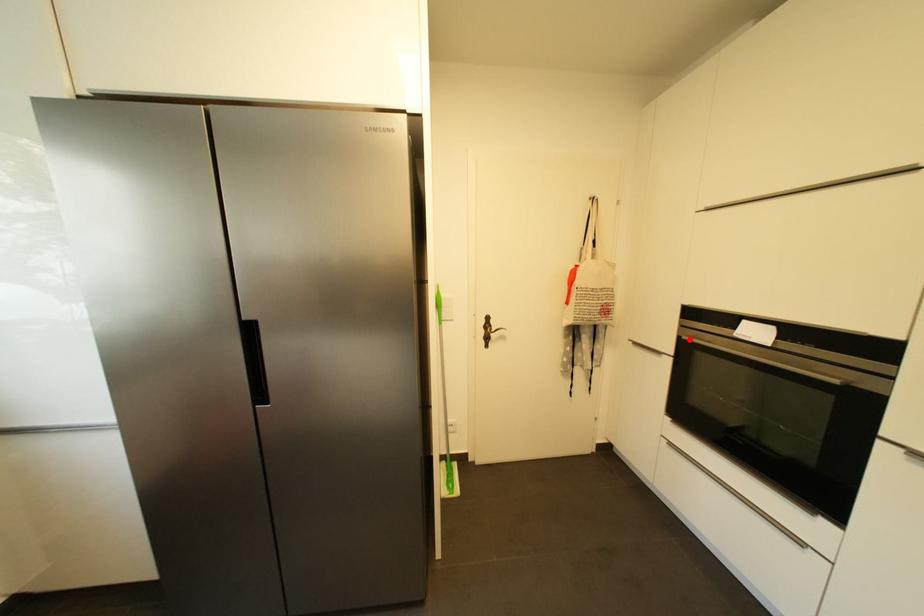
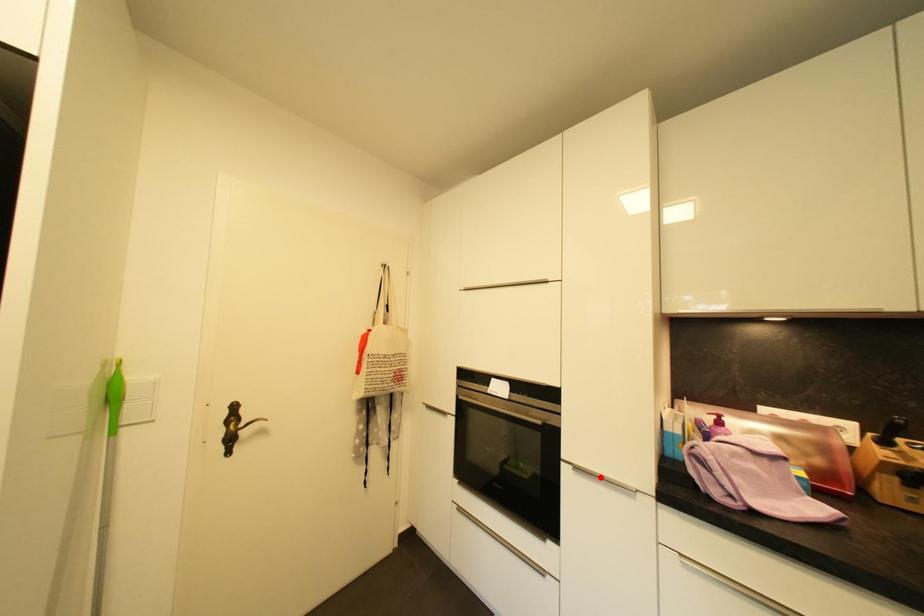
I am providing you with two images of the same scene from different viewpoints. A red point is marked on the first image and another point is marked on the second image. Does the point marked in image1 correspond to the same location as the one in image2?

No